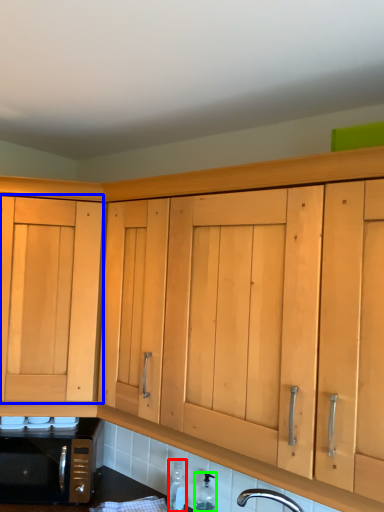
Question: Considering the real-world distances, which object is farthest from bottle (highlighted by a red box)? cabinetry (highlighted by a blue box) or bottle (highlighted by a green box)?

Choices:
 (A) cabinetry
 (B) bottle

Answer: (A)